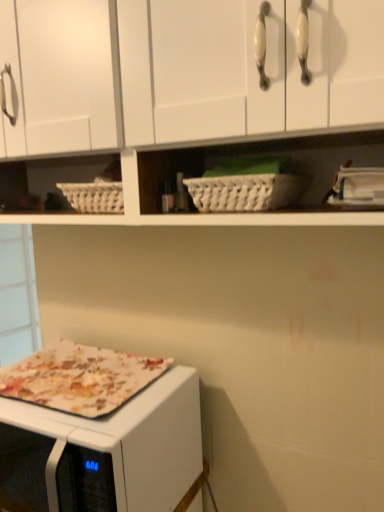
What do you see at coordinates (80, 378) in the screenshot? The height and width of the screenshot is (512, 384). I see `printed fabric pizza at lower left` at bounding box center [80, 378].

Measure the distance between white matte cabinet at upper center and camera.

white matte cabinet at upper center and camera are 57.52 centimeters apart from each other.

The height and width of the screenshot is (512, 384). What do you see at coordinates (127, 445) in the screenshot?
I see `floral fabric microwave oven at lower left` at bounding box center [127, 445].

The width and height of the screenshot is (384, 512). In order to click on printed fabric pizza at lower left in this screenshot , I will do `click(80, 378)`.

Where is `basket above the printed fabric pizza at lower left (from the image's perspective)`? basket above the printed fabric pizza at lower left (from the image's perspective) is located at coordinates (244, 192).

Consider the image. Is white wicker basket at center closer to the viewer compared to printed fabric pizza at lower left?

Yes.

From the image's perspective, who appears lower, white wicker basket at center or printed fabric pizza at lower left?

printed fabric pizza at lower left.

Can you confirm if white wicker basket at center is bigger than printed fabric pizza at lower left?

Yes, white wicker basket at center is bigger than printed fabric pizza at lower left.

Is point (221, 201) farther from viewer compared to point (275, 84)?

Yes, it is behind point (275, 84).

Is white wicker basket at center aimed at white matte cabinet at upper center?

Yes, white wicker basket at center is aimed at white matte cabinet at upper center.

Considering the relative sizes of white wicker basket at center and white matte cabinet at upper center in the image provided, is white wicker basket at center taller than white matte cabinet at upper center?

No.

Considering the relative sizes of white wicker basket at center and white matte cabinet at upper center in the image provided, is white wicker basket at center bigger than white matte cabinet at upper center?

Incorrect, white wicker basket at center is not larger than white matte cabinet at upper center.

What's the angular difference between printed fabric pizza at lower left and white matte cabinet at upper center's facing directions?

There is a 0.2-degree angle between the facing directions of printed fabric pizza at lower left and white matte cabinet at upper center.

Which object is positioned more to the right, printed fabric pizza at lower left or white matte cabinet at upper center?

white matte cabinet at upper center.

How distant is printed fabric pizza at lower left from white matte cabinet at upper center?

printed fabric pizza at lower left and white matte cabinet at upper center are 20.96 inches apart from each other.

In order to click on pizza on the left of white matte cabinet at upper center in this screenshot , I will do `click(80, 378)`.

Considering the positions of objects floral fabric microwave oven at lower left and white wicker basket at center in the image provided, who is more to the left, floral fabric microwave oven at lower left or white wicker basket at center?

floral fabric microwave oven at lower left.

The width and height of the screenshot is (384, 512). In the image, there is a white wicker basket at center. Find the location of `microwave oven below it (from the image's perspective)`. microwave oven below it (from the image's perspective) is located at coordinates (127, 445).

How far apart are floral fabric microwave oven at lower left and white wicker basket at center?

floral fabric microwave oven at lower left and white wicker basket at center are 21.45 inches apart.

Does floral fabric microwave oven at lower left have a lesser width compared to white wicker basket at center?

In fact, floral fabric microwave oven at lower left might be wider than white wicker basket at center.

Is white wicker basket at center turned away from floral fabric microwave oven at lower left?

That's not correct — white wicker basket at center is not looking away from floral fabric microwave oven at lower left.

From a real-world perspective, is white wicker basket at center physically located above or below floral fabric microwave oven at lower left?

Clearly, from a real-world perspective, white wicker basket at center is above floral fabric microwave oven at lower left.

From their relative heights in the image, would you say white wicker basket at center is taller or shorter than floral fabric microwave oven at lower left?

In the image, white wicker basket at center appears to be shorter than floral fabric microwave oven at lower left.

Is floral fabric microwave oven at lower left completely or partially inside white wicker basket at center?

No.

Can you confirm if printed fabric pizza at lower left is shorter than white wicker basket at center?

Indeed, printed fabric pizza at lower left has a lesser height compared to white wicker basket at center.

From the image's perspective, between printed fabric pizza at lower left and white wicker basket at center, which one is located above?

white wicker basket at center is shown above in the image.

Which object is further away from the camera, printed fabric pizza at lower left or white wicker basket at center?

printed fabric pizza at lower left is behind.

Would you say printed fabric pizza at lower left contains white wicker basket at center?

No, white wicker basket at center is not a part of printed fabric pizza at lower left.

Where is `cabinetry located above the white wicker basket at center (from the image's perspective)`? This screenshot has height=512, width=384. cabinetry located above the white wicker basket at center (from the image's perspective) is located at coordinates (188, 74).

Looking at this image, is white matte cabinet at upper center looking in the opposite direction of white wicker basket at center?

Absolutely, white matte cabinet at upper center is directed away from white wicker basket at center.

From the image's perspective, which is above, white matte cabinet at upper center or white wicker basket at center?

From the image's view, white matte cabinet at upper center is above.

Relative to white wicker basket at center, is white matte cabinet at upper center in front or behind?

white matte cabinet at upper center is in front of white wicker basket at center.

Identify the location of pizza below the white wicker basket at center (from a real-world perspective). (80, 378).

The width and height of the screenshot is (384, 512). I want to click on basket on the right of white matte cabinet at upper center, so click(244, 192).

Which object lies nearer to the anchor point floral fabric microwave oven at lower left, white matte cabinet at upper center or printed fabric pizza at lower left?

The object closer to floral fabric microwave oven at lower left is printed fabric pizza at lower left.

When comparing their distances from floral fabric microwave oven at lower left, does white matte cabinet at upper center or white wicker basket at center seem closer?

white wicker basket at center is closer to floral fabric microwave oven at lower left.

Estimate the real-world distances between objects in this image. Which object is closer to white wicker basket at center, white matte cabinet at upper center or printed fabric pizza at lower left?

white matte cabinet at upper center is positioned closer to the anchor white wicker basket at center.

Estimate the real-world distances between objects in this image. Which object is further from floral fabric microwave oven at lower left, printed fabric pizza at lower left or white wicker basket at center?

white wicker basket at center lies further to floral fabric microwave oven at lower left than the other object.

Based on their spatial positions, is printed fabric pizza at lower left or floral fabric microwave oven at lower left closer to white matte cabinet at upper center?

Based on the image, printed fabric pizza at lower left appears to be nearer to white matte cabinet at upper center.

Considering their positions, is floral fabric microwave oven at lower left positioned closer to white wicker basket at center than white matte cabinet at upper center?

white matte cabinet at upper center.

When comparing their distances from printed fabric pizza at lower left, does white matte cabinet at upper center or white wicker basket at center seem further?

white wicker basket at center is positioned further to the anchor printed fabric pizza at lower left.

Consider the image. Based on their spatial positions, is white matte cabinet at upper center or floral fabric microwave oven at lower left closer to printed fabric pizza at lower left?

floral fabric microwave oven at lower left is positioned closer to the anchor printed fabric pizza at lower left.

The width and height of the screenshot is (384, 512). In order to click on basket between white matte cabinet at upper center and printed fabric pizza at lower left from top to bottom in this screenshot , I will do `click(244, 192)`.

Identify the location of pizza between white wicker basket at center and floral fabric microwave oven at lower left vertically. The image size is (384, 512). (80, 378).

Where is `basket between white matte cabinet at upper center and floral fabric microwave oven at lower left vertically`? basket between white matte cabinet at upper center and floral fabric microwave oven at lower left vertically is located at coordinates (244, 192).

The image size is (384, 512). I want to click on pizza between white matte cabinet at upper center and floral fabric microwave oven at lower left from top to bottom, so (x=80, y=378).